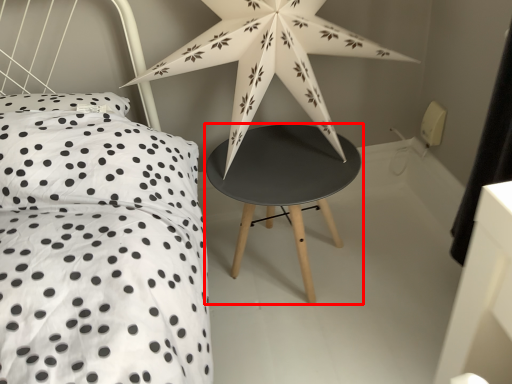
Question: From the image's perspective, considering the relative positions of stool (annotated by the red box) and star in the image provided, where is stool (annotated by the red box) located with respect to the staircase?

Choices:
 (A) above
 (B) below

Answer: (B)